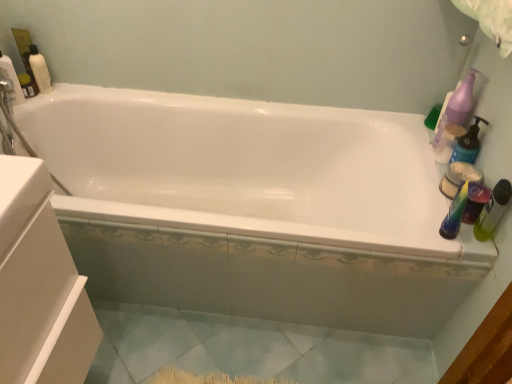
Where is `free space above light blue ceramic tile at lower center (from a real-world perspective)`? This screenshot has width=512, height=384. free space above light blue ceramic tile at lower center (from a real-world perspective) is located at coordinates (257, 348).